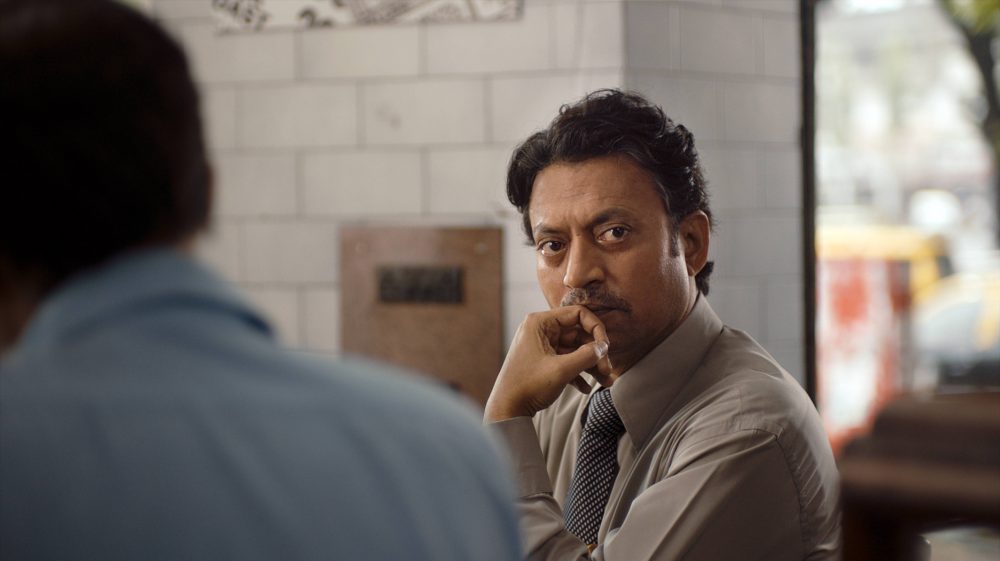
Where is `wall`? The width and height of the screenshot is (1000, 561). wall is located at coordinates (483, 114).